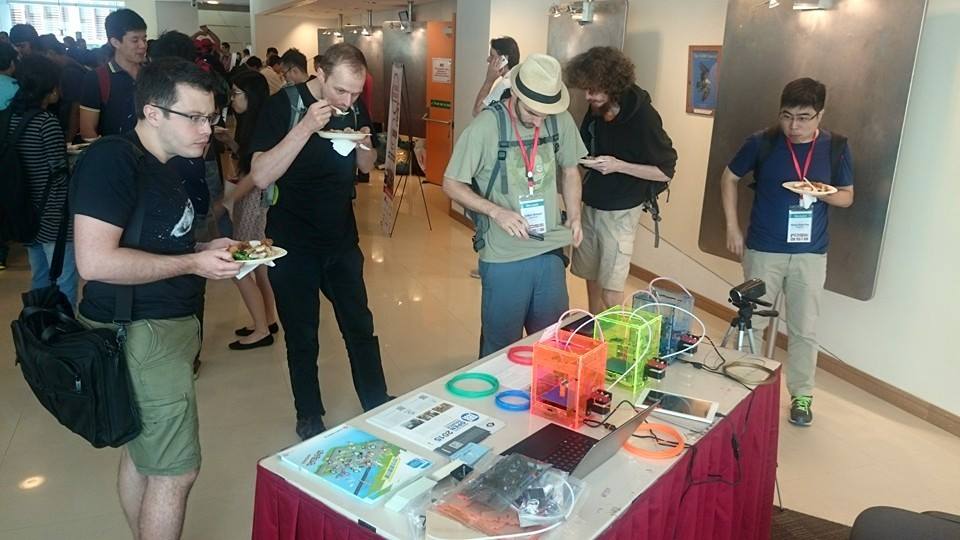
I want to click on science display table, so click(514, 423).